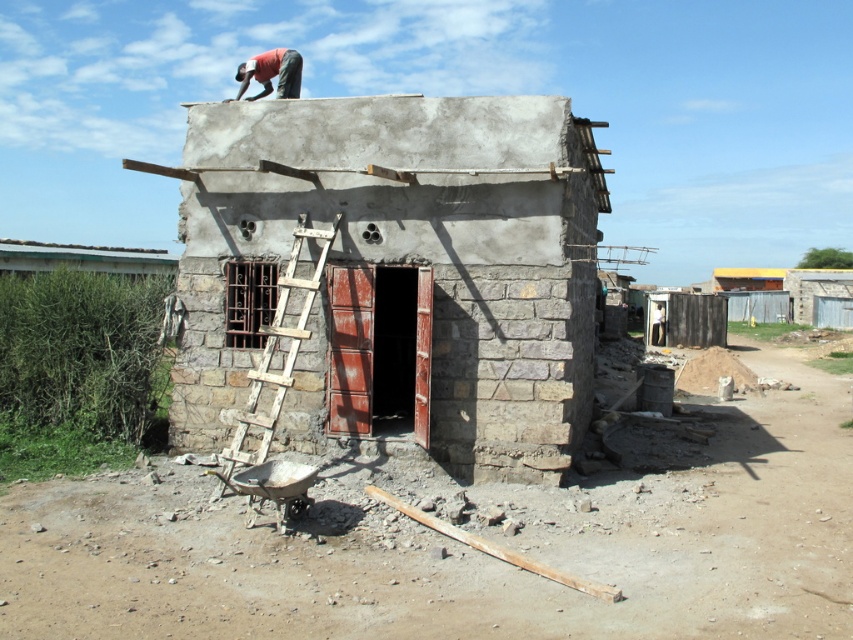
Which is above, smooth concrete hut at center or matte red shirt at upper center?

Positioned higher is matte red shirt at upper center.

Is smooth concrete hut at center bigger than matte red shirt at upper center?

No, smooth concrete hut at center is not bigger than matte red shirt at upper center.

Find the location of a particular element. Image resolution: width=853 pixels, height=640 pixels. smooth concrete hut at center is located at coordinates (392, 280).

Is point (225, 456) more distant than point (258, 365)?

No, it is not.

Based on the photo, does smooth concrete hut at center lie in front of weathered wood ladder at center?

No, smooth concrete hut at center is behind weathered wood ladder at center.

Describe the element at coordinates (392, 280) in the screenshot. I see `smooth concrete hut at center` at that location.

This screenshot has width=853, height=640. Find the location of `smooth concrete hut at center`. smooth concrete hut at center is located at coordinates (392, 280).

Describe the element at coordinates (276, 349) in the screenshot. I see `weathered wood ladder at center` at that location.

Does weathered wood ladder at center have a lesser height compared to matte red shirt at upper center?

Correct, weathered wood ladder at center is not as tall as matte red shirt at upper center.

Describe the element at coordinates (276, 349) in the screenshot. I see `weathered wood ladder at center` at that location.

Find the location of `weathered wood ladder at center`. weathered wood ladder at center is located at coordinates (276, 349).